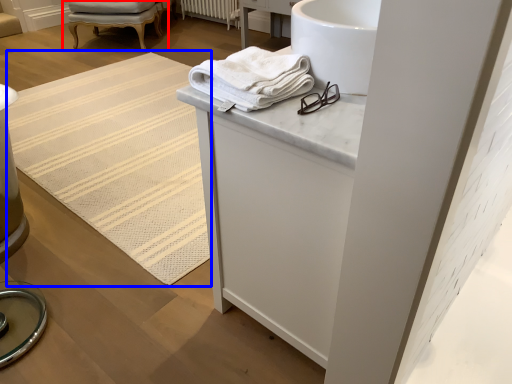
Question: Which of the following is the closest to the observer, chair (highlighted by a red box) or mat (highlighted by a blue box)?

Choices:
 (A) chair
 (B) mat

Answer: (B)